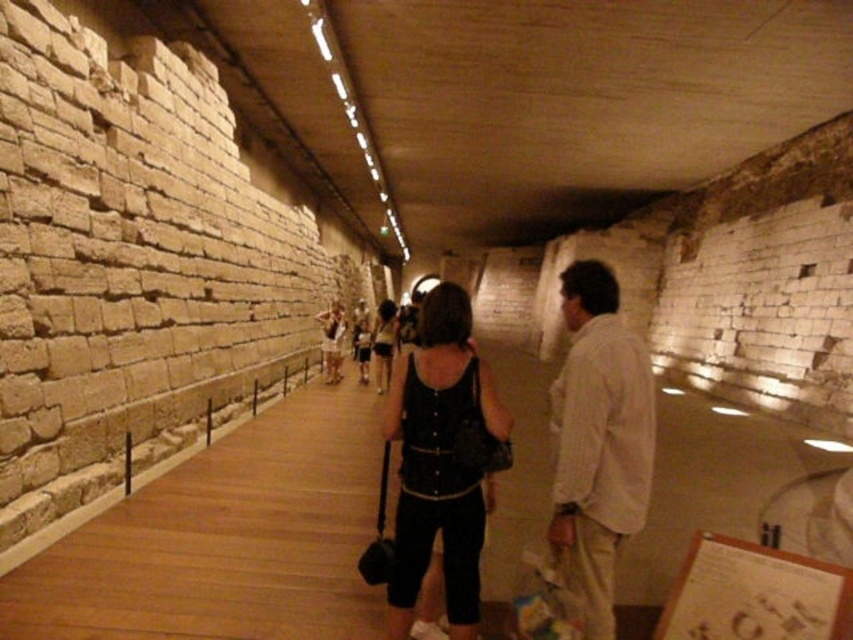
You are a tour guide in this corridor and need to point out two visitors wearing contrasting outfits. Which of the two, the white striped shirt at center or the dark gray fabric dress at center, is shorter in height?

The white striped shirt at center has a lesser height compared to the dark gray fabric dress at center, so the person wearing the white striped shirt at center is shorter.

From the picture: You are a photographer in the corridor and want to take a picture of the two people wearing the black leather tank top at center and the dark gray fabric dress at center. Which person should you focus on first if you want to capture them both in the frame without moving the camera?

You should focus on the dark gray fabric dress at center first because it is on the left side of the black leather tank top at center, so capturing it first ensures both are in the frame without needing to adjust the camera position.